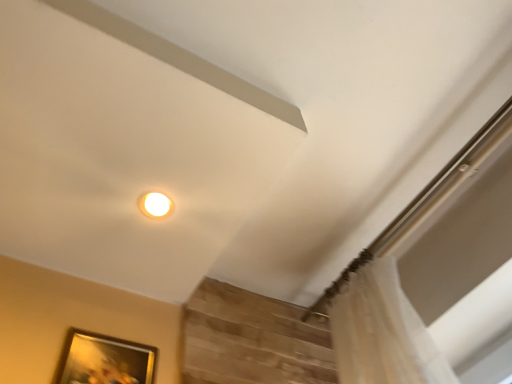
This screenshot has height=384, width=512. Describe the element at coordinates (104, 360) in the screenshot. I see `gold-framed picture at lower left` at that location.

Where is `gold-framed picture at lower left`? gold-framed picture at lower left is located at coordinates (104, 360).

Locate an element on the screen. The height and width of the screenshot is (384, 512). gold-framed picture at lower left is located at coordinates (104, 360).